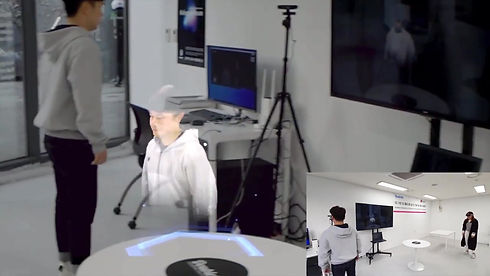
Image resolution: width=490 pixels, height=276 pixels. I want to click on mouse on white desk, so click(x=199, y=123).